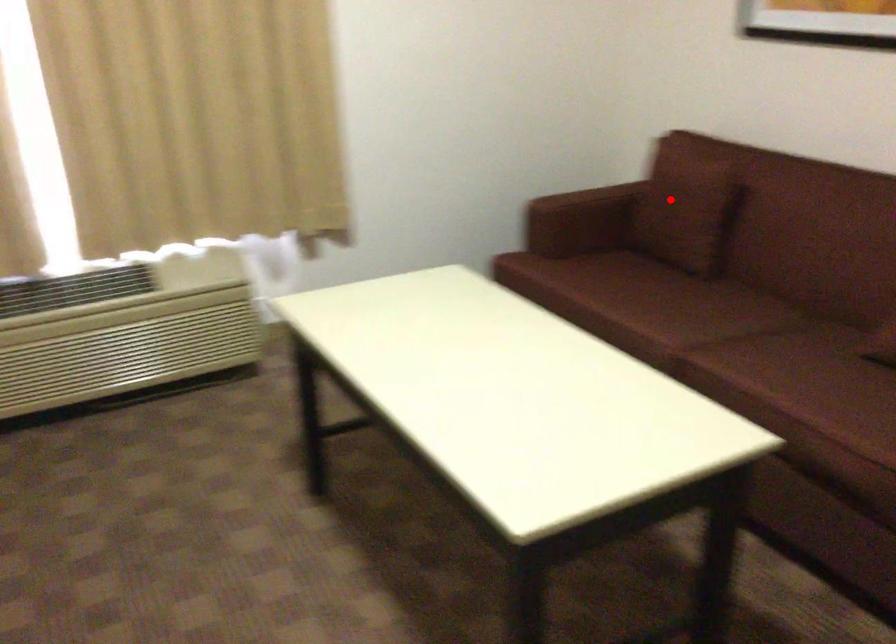
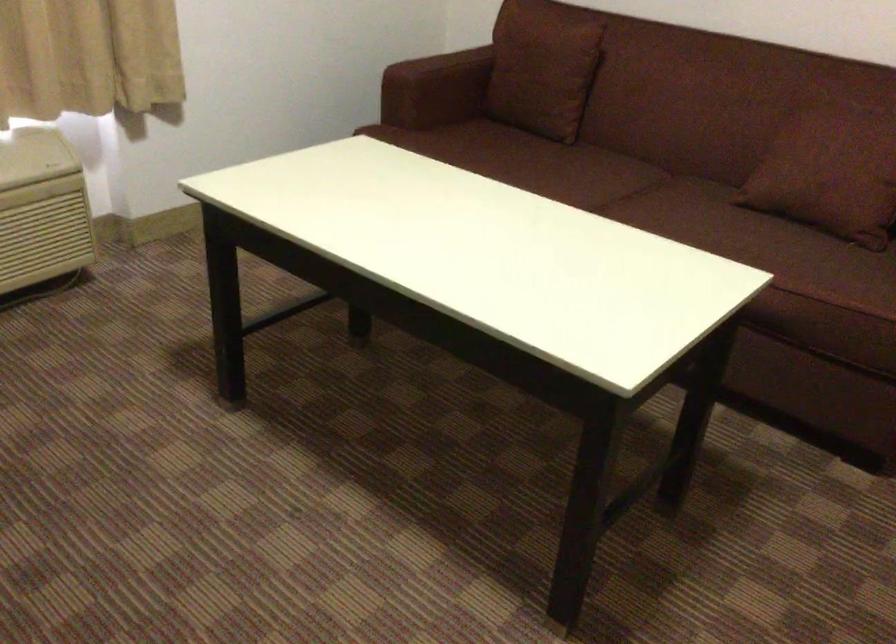
Find the pixel in the second image that matches the highlighted location in the first image.

(543, 69)